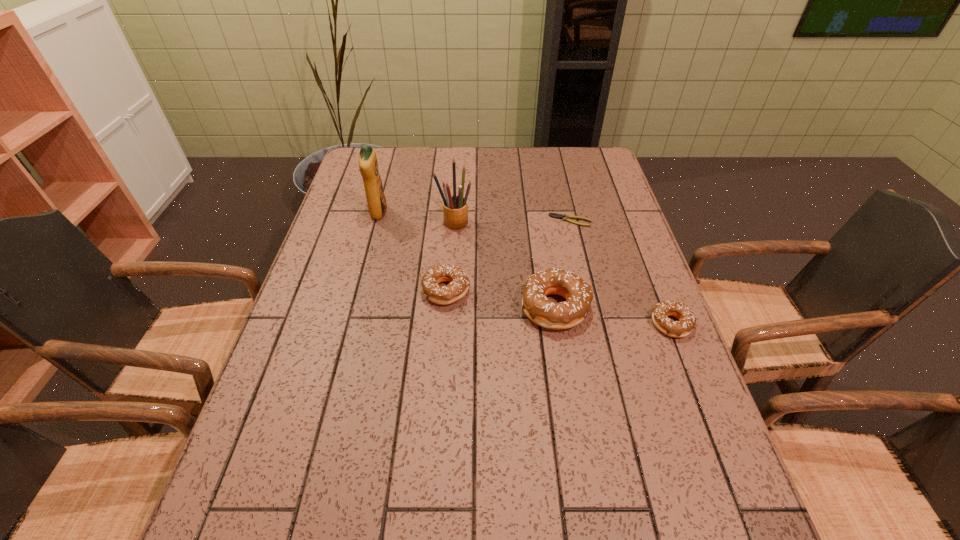
You are a GUI agent. You are given a task and a screenshot of the screen. Output one action in this format:
    pyautogui.click(x=<x>, y=<y>)
    Task: Click on the free spot between the shortest object and the second tallest object
    
    Given the screenshot: What is the action you would take?
    pyautogui.click(x=513, y=221)

You are a GUI agent. You are given a task and a screenshot of the screen. Output one action in this format:
    pyautogui.click(x=<x>, y=<y>)
    Task: Click on the free spot between the leftmost object and the fourth shortest object
    The width and height of the screenshot is (960, 540).
    Given the screenshot: What is the action you would take?
    coord(467,260)

You are a GUI agent. You are given a task and a screenshot of the screen. Output one action in this format:
    pyautogui.click(x=<x>, y=<y>)
    Task: Click on the vacant area that lies between the detergent and the third tallest object
    Image resolution: width=960 pixels, height=540 pixels.
    Given the screenshot: What is the action you would take?
    pyautogui.click(x=467, y=260)

Choose which object is the second nearest neighbor to the leftmost doughnut. Please provide its 2D coordinates. Your answer should be formatted as a tuple, i.e. [(x, y)], where the tuple contains the x and y coordinates of a point satisfying the conditions above.

[(455, 208)]

Where is `object that can be found as the closest to the shortest object`? The image size is (960, 540). object that can be found as the closest to the shortest object is located at coordinates (541, 310).

Identify which doughnut is the nearest to the shortest doughnut. Please provide its 2D coordinates. Your answer should be formatted as a tuple, i.e. [(x, y)], where the tuple contains the x and y coordinates of a point satisfying the conditions above.

[(541, 310)]

Locate which doughnut ranks second in proximity to the fourth shortest object. Please provide its 2D coordinates. Your answer should be formatted as a tuple, i.e. [(x, y)], where the tuple contains the x and y coordinates of a point satisfying the conditions above.

[(683, 327)]

Where is `free point that satisfies the following two spatial constraints: 1. on the label of the leftmost object; 2. on the left side of the shortest object`? free point that satisfies the following two spatial constraints: 1. on the label of the leftmost object; 2. on the left side of the shortest object is located at coordinates [x=376, y=220].

The width and height of the screenshot is (960, 540). I want to click on free point that satisfies the following two spatial constraints: 1. on the front side of the third shortest object; 2. on the right side of the second shortest object, so click(444, 324).

Locate an element on the screen. free location that satisfies the following two spatial constraints: 1. on the label of the detergent; 2. on the left side of the leftmost doughnut is located at coordinates (358, 291).